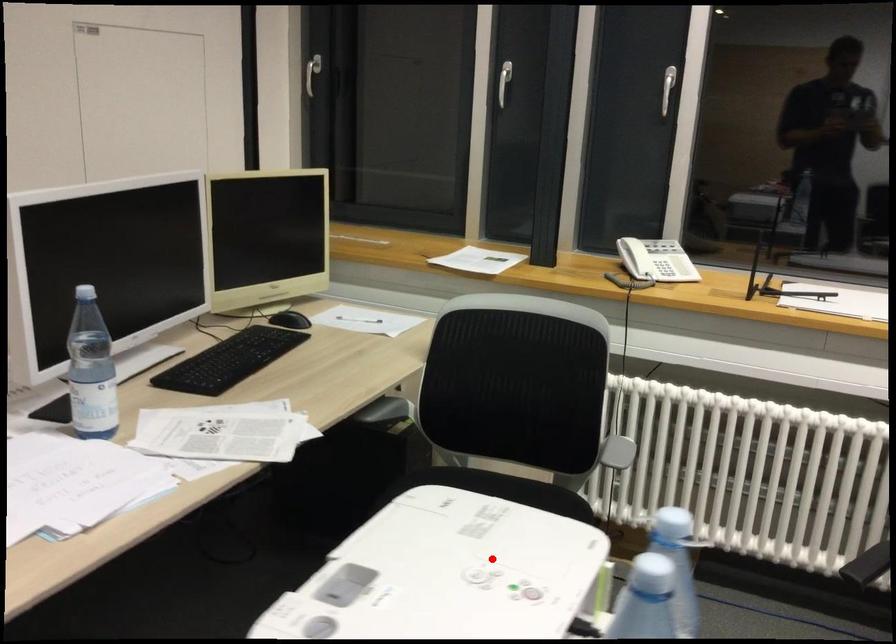
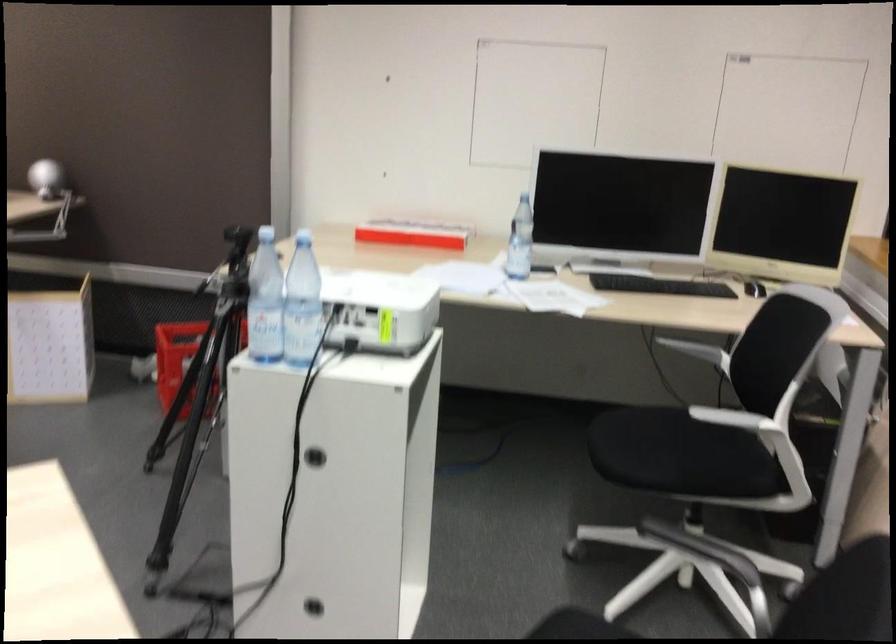
Question: I am providing you with two images of the same scene from different viewpoints. Image1 has a red point marked. In image2, the corresponding 3D location appears at what relative position? Reply with the corresponding letter.

Choices:
 (A) Closer
 (B) Farther

Answer: (B)